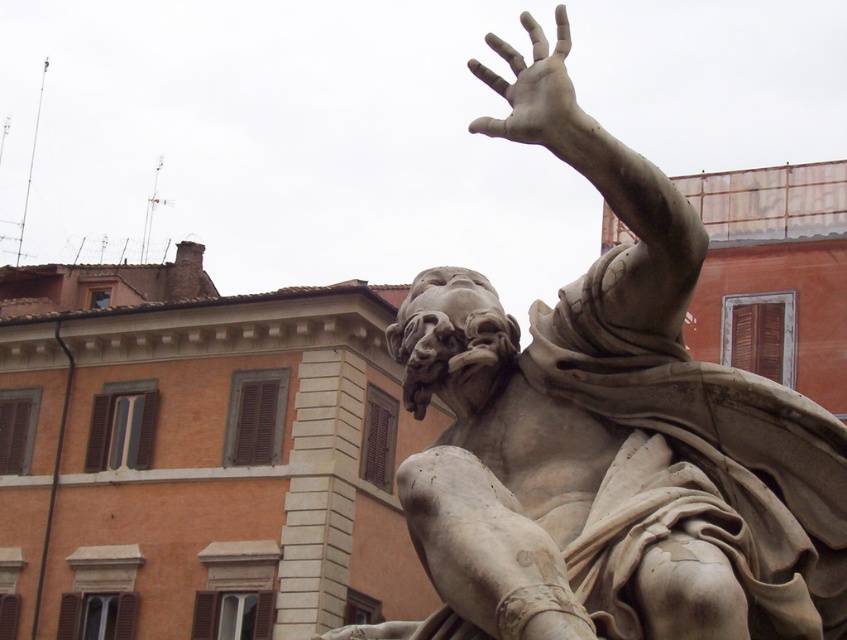
Question: Does white marble statue at upper right have a smaller size compared to smooth stone hand at upper right?

Choices:
 (A) no
 (B) yes

Answer: (B)

Question: Can you confirm if white marble statue at upper right is positioned above smooth stone hand at upper right?

Choices:
 (A) yes
 (B) no

Answer: (B)

Question: Among these points, which one is farthest from the camera?

Choices:
 (A) (573, 134)
 (B) (652, 451)

Answer: (B)

Question: Which point appears closest to the camera in this image?

Choices:
 (A) (681, 518)
 (B) (543, 38)

Answer: (A)

Question: From the image, what is the correct spatial relationship of white marble statue at upper right in relation to smooth stone hand at upper right?

Choices:
 (A) below
 (B) above

Answer: (A)